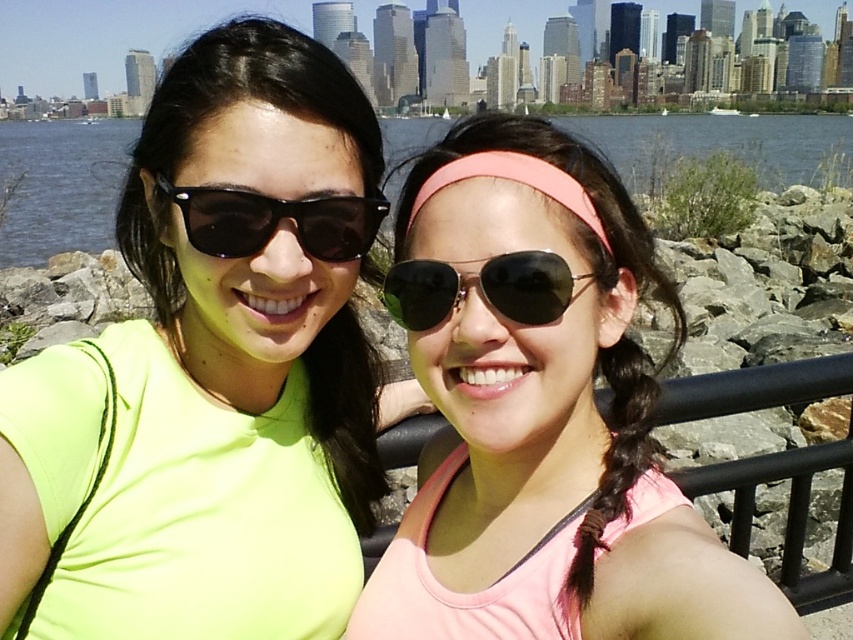
Which is more to the right, black reflective sunglasses at left or pink fabric headband at center?

From the viewer's perspective, pink fabric headband at center appears more on the right side.

Is black reflective sunglasses at left above pink fabric headband at center?

Actually, black reflective sunglasses at left is below pink fabric headband at center.

Does point (297, 237) lie behind point (577, 211)?

Yes, it is behind point (577, 211).

Where is `black reflective sunglasses at left`? This screenshot has width=853, height=640. black reflective sunglasses at left is located at coordinates (276, 221).

Is point (593, 518) in front of point (514, 179)?

Yes, it is.

Is point (465, 323) positioned in front of point (550, 188)?

No, (465, 323) is further to viewer.

Locate an element on the screen. pink matte headband at center is located at coordinates (544, 419).

Does point (535, 307) lie behind point (572, 202)?

Yes, it is behind point (572, 202).

Does metallic reflective sunglasses at center have a greater height compared to pink fabric headband at center?

In fact, metallic reflective sunglasses at center may be shorter than pink fabric headband at center.

Is point (518, 280) farther from camera compared to point (482, 168)?

No, it is not.

Where is `metallic reflective sunglasses at center`? The height and width of the screenshot is (640, 853). metallic reflective sunglasses at center is located at coordinates (527, 285).